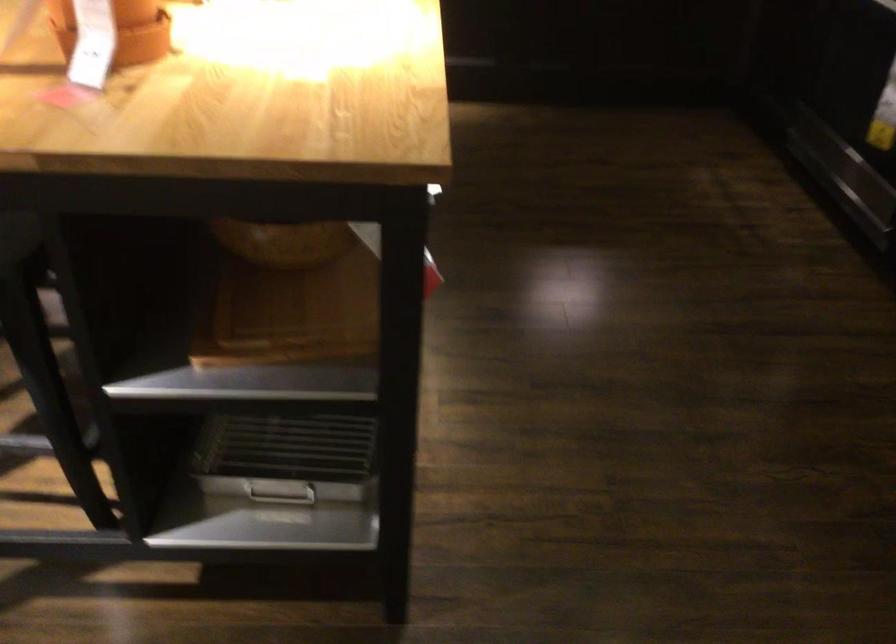
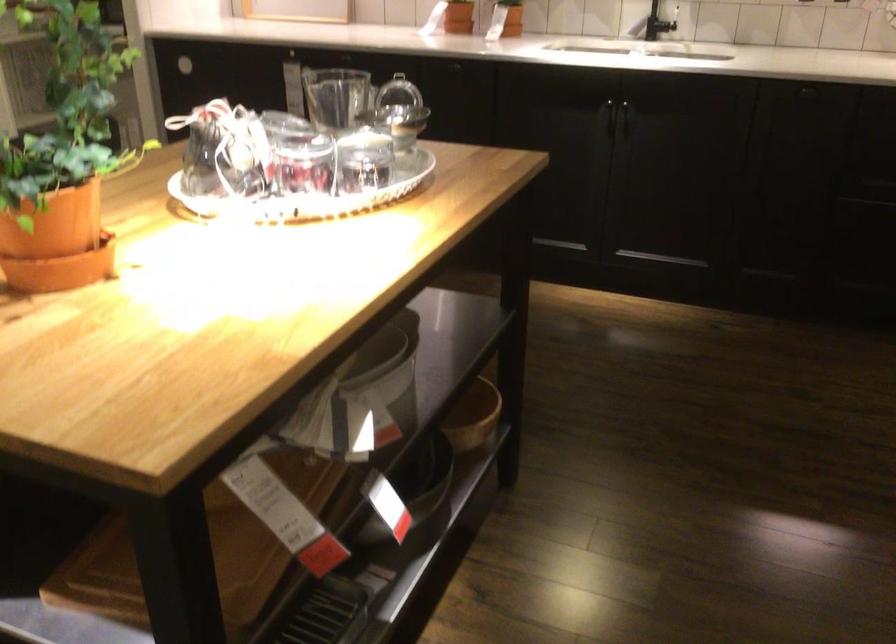
Question: How did the camera likely rotate?

Choices:
 (A) Left
 (B) Right
 (C) Up
 (D) Down

Answer: (A)